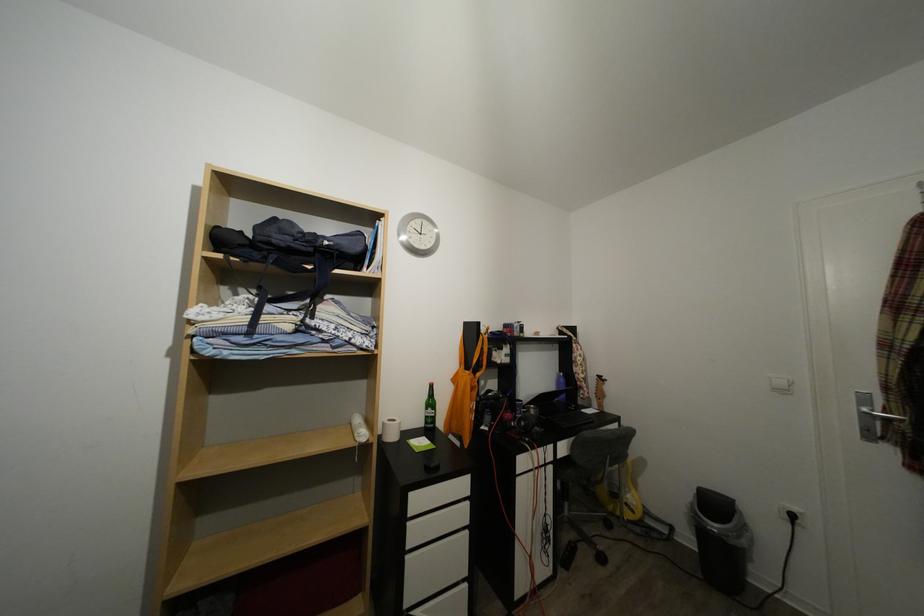
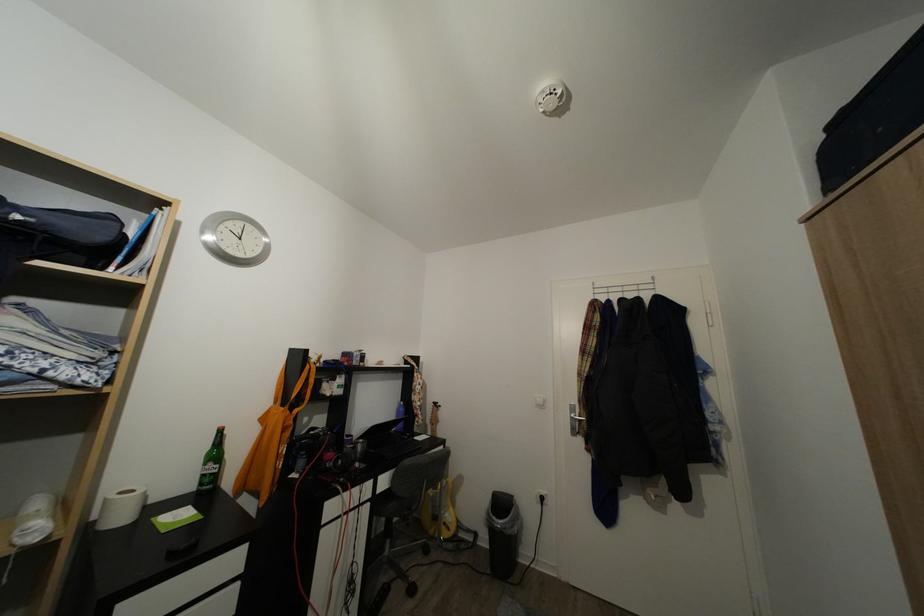
Locate, in the second image, the point that corresponds to the point at 634,511 in the first image.

(453, 531)